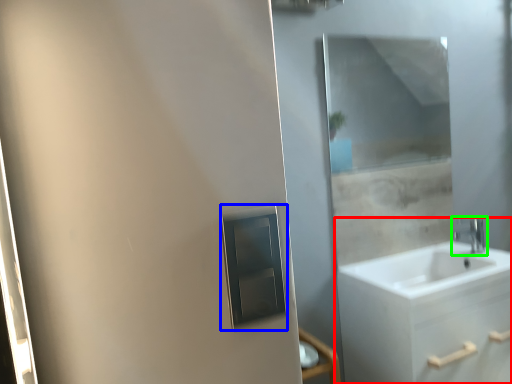
Question: Estimate the real-world distances between objects in this image. Which object is farther from bathroom cabinet (highlighted by a red box), medicine cabinet (highlighted by a blue box) or tap (highlighted by a green box)?

Choices:
 (A) medicine cabinet
 (B) tap

Answer: (A)